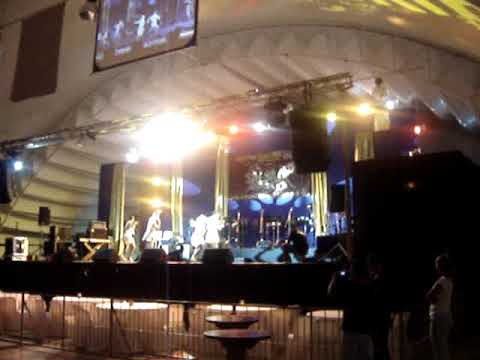
This screenshot has height=360, width=480. What are the coordinates of `rounded arch` in the screenshot? It's located at (38, 171), (214, 57), (450, 71).